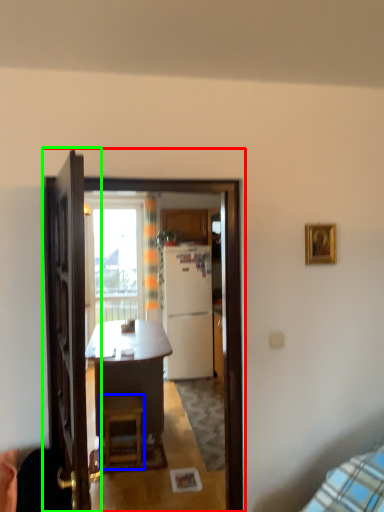
Question: Which is nearer to the screen door (highlighted by a red box)? stool (highlighted by a blue box) or door (highlighted by a green box).

Choices:
 (A) stool
 (B) door

Answer: (B)